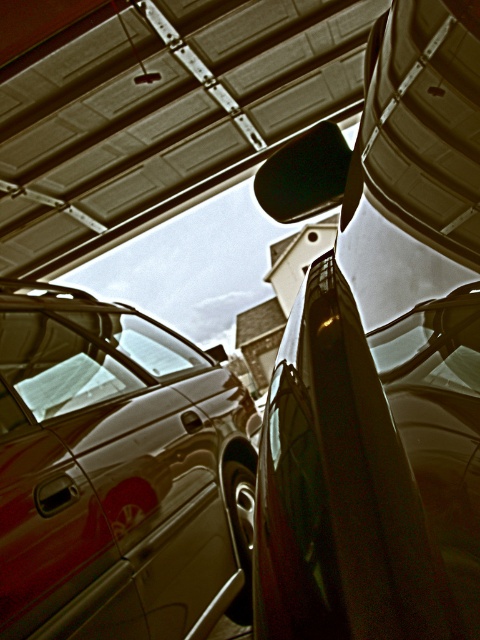
In the scene shown: You are a delivery person with a cart that is 1.5 meters wide. You need to navigate between the glossy metallic car at upper right and the shiny metallic van at lower left. Can your cart fit through the space between them?

The glossy metallic car at upper right and the shiny metallic van at lower left are 1.41 meters apart. Since your cart is 1.5 meters wide, it cannot fit through the space between them as the gap is narrower than the cart.

You are a photographer trying to capture both the glossy metallic car at upper right and the shiny metallic van at lower left in a single frame. Given their sizes, which vehicle should you position closer to the camera to ensure both appear proportionally sized in the photo?

Since the glossy metallic car at upper right is smaller than the shiny metallic van at lower left, you should position the glossy metallic car at upper right closer to the camera to balance their sizes in the photo.